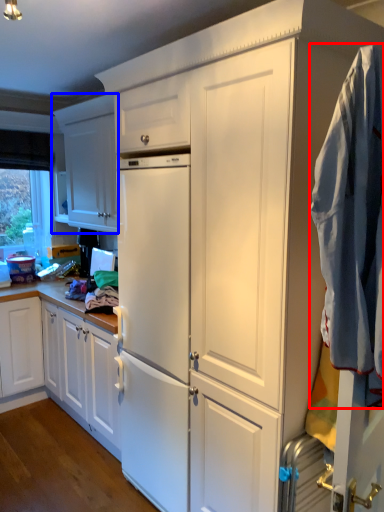
Question: Which object appears farthest to the camera in this image, clothing (highlighted by a red box) or cabinetry (highlighted by a blue box)?

Choices:
 (A) clothing
 (B) cabinetry

Answer: (B)